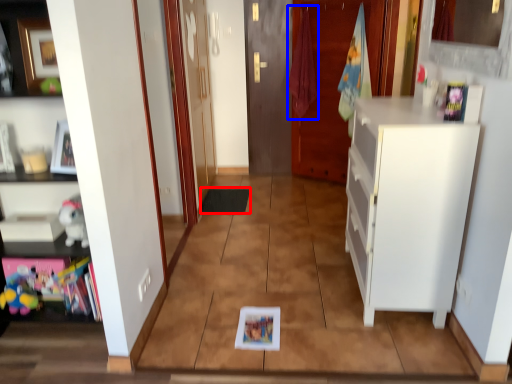
Question: Which of the following is the closest to the observer, mat (highlighted by a red box) or laundry (highlighted by a blue box)?

Choices:
 (A) mat
 (B) laundry

Answer: (A)